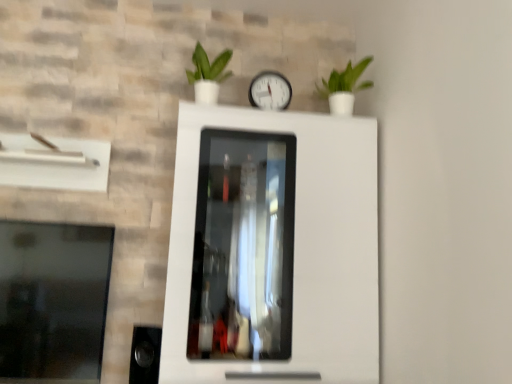
Question: Does white plastic clock at center appear on the left side of transparent glass window at left?

Choices:
 (A) no
 (B) yes

Answer: (A)

Question: Does white plastic clock at center have a greater height compared to transparent glass window at left?

Choices:
 (A) yes
 (B) no

Answer: (B)

Question: Would you say white plastic clock at center is a long distance from transparent glass window at left?

Choices:
 (A) no
 (B) yes

Answer: (B)

Question: From a real-world perspective, is white plastic clock at center under transparent glass window at left?

Choices:
 (A) yes
 (B) no

Answer: (B)

Question: From the image's perspective, does white plastic clock at center appear higher than transparent glass window at left?

Choices:
 (A) yes
 (B) no

Answer: (A)

Question: Is white plastic clock at center positioned in front of transparent glass window at left?

Choices:
 (A) yes
 (B) no

Answer: (B)

Question: Does transparent glass window at left have a smaller size compared to green matte plant at upper center, which ranks as the 1th houseplant in left-to-right order?

Choices:
 (A) yes
 (B) no

Answer: (B)

Question: Could you tell me if transparent glass window at left is turned towards green matte plant at upper center, which ranks as the 1th houseplant in left-to-right order?

Choices:
 (A) no
 (B) yes

Answer: (A)

Question: Does transparent glass window at left lie behind green matte plant at upper center, the 2th houseplant from the right?

Choices:
 (A) yes
 (B) no

Answer: (B)

Question: Is transparent glass window at left looking in the opposite direction of green matte plant at upper center, the 2th houseplant from the right?

Choices:
 (A) yes
 (B) no

Answer: (B)

Question: Does transparent glass window at left have a lesser width compared to green matte plant at upper center, which ranks as the 1th houseplant in left-to-right order?

Choices:
 (A) no
 (B) yes

Answer: (B)

Question: Is transparent glass window at left outside of green matte plant at upper center, which ranks as the 1th houseplant in left-to-right order?

Choices:
 (A) yes
 (B) no

Answer: (A)

Question: Is green matte plant at upper right, which appears as the second houseplant when viewed from the left, far from white plastic clock at center?

Choices:
 (A) yes
 (B) no

Answer: (B)